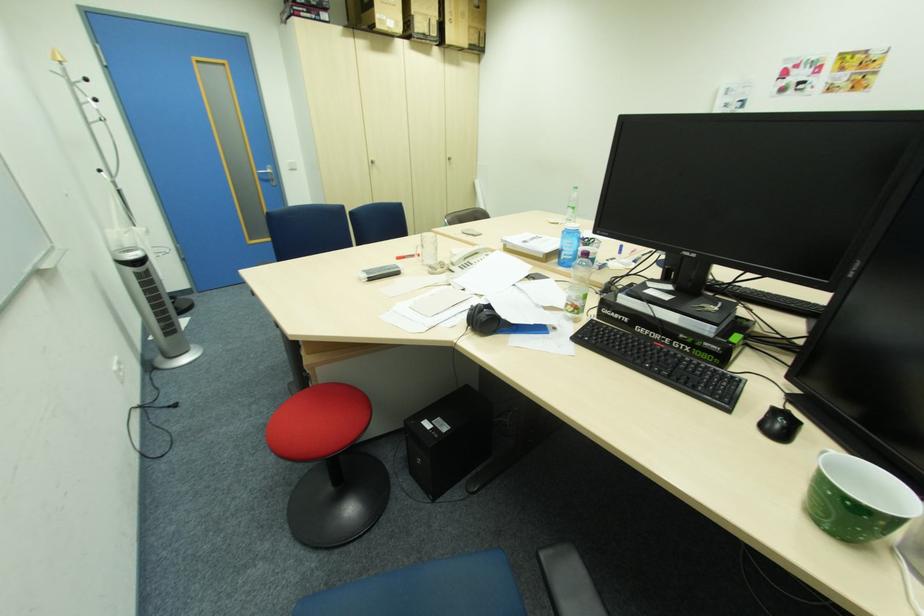
In order to click on glass mug handle in this screenshot , I will do `click(822, 455)`.